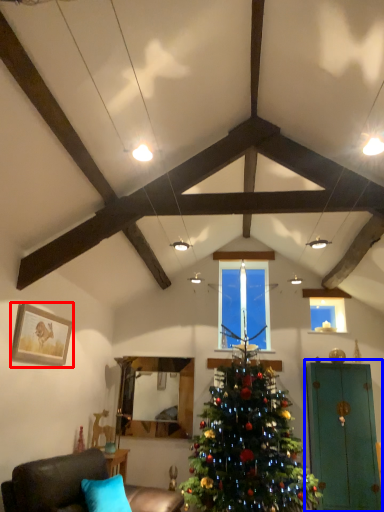
Question: Which object appears farthest to the camera in this image, picture frame (highlighted by a red box) or armoire (highlighted by a blue box)?

Choices:
 (A) picture frame
 (B) armoire

Answer: (B)